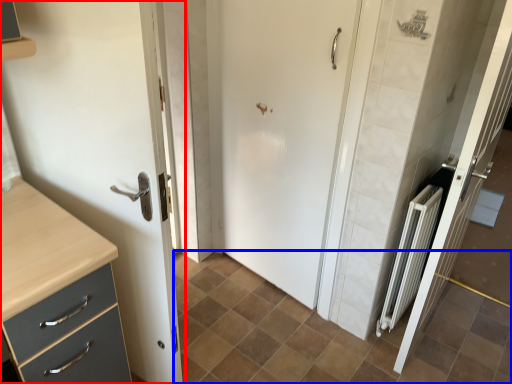
Question: Among these objects, which one is farthest to the camera, door (highlighted by a red box) or ceramic tile (highlighted by a blue box)?

Choices:
 (A) door
 (B) ceramic tile

Answer: (B)